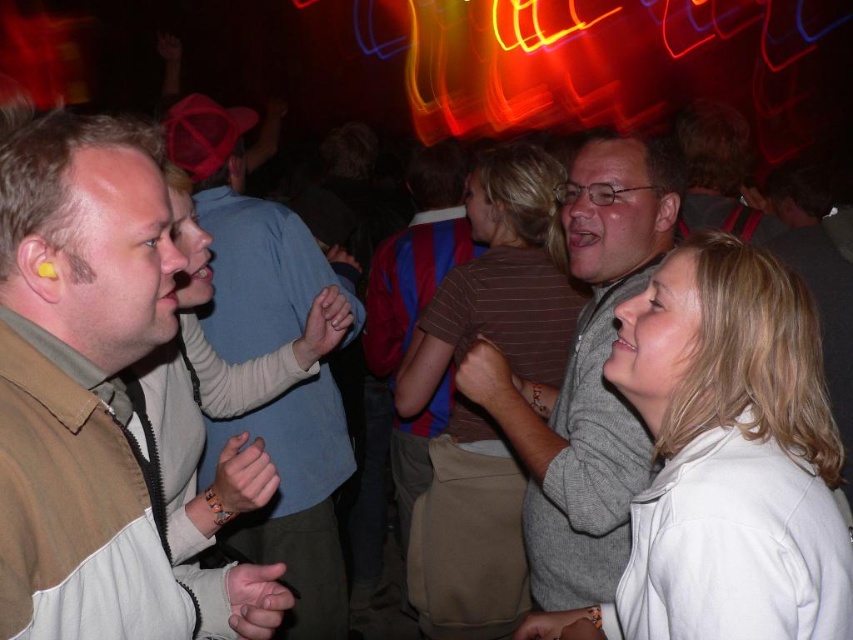
Question: Where is matte beige jacket at left located in relation to striped shirt at center in the image?

Choices:
 (A) above
 (B) below

Answer: (A)

Question: Which of the following is the closest to the observer?

Choices:
 (A) gray sweater at center
 (B) matte beige jacket at left
 (C) striped shirt at center

Answer: (B)

Question: Which object is farther from the camera taking this photo?

Choices:
 (A) matte beige jacket at left
 (B) smooth gray sweater at center
 (C) matte gray shirt at center

Answer: (B)

Question: Can you confirm if smooth gray sweater at center is thinner than matte brown shirt at center?

Choices:
 (A) no
 (B) yes

Answer: (A)

Question: Estimate the real-world distances between objects in this image. Which object is farther from the smooth gray sweater at center?

Choices:
 (A) striped shirt at center
 (B) tan leather jacket at left

Answer: (B)

Question: Does smooth beige jacket at lower right come in front of matte brown shirt at center?

Choices:
 (A) no
 (B) yes

Answer: (B)